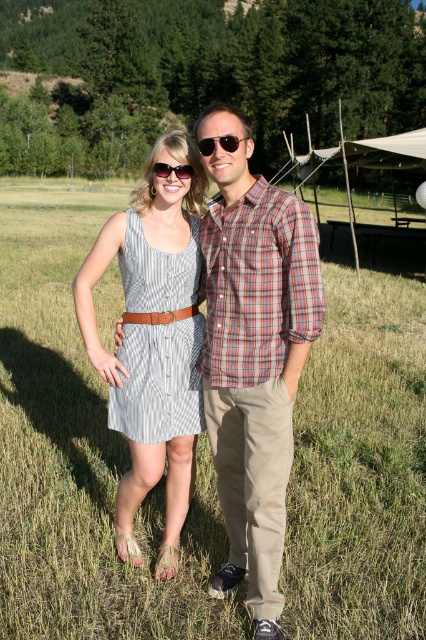
Who is lower down, striped fabric dress at center or striped cotton dress at center?

striped fabric dress at center

Does point (195, 179) come closer to viewer compared to point (186, 396)?

That is True.

This screenshot has width=426, height=640. Find the location of `striped fabric dress at center`. striped fabric dress at center is located at coordinates (152, 340).

Does green grass at center appear on the left side of plaid cotton shirt at center?

Indeed, green grass at center is positioned on the left side of plaid cotton shirt at center.

Who is taller, green grass at center or plaid cotton shirt at center?

Standing taller between the two is green grass at center.

Describe the element at coordinates (81, 452) in the screenshot. I see `green grass at center` at that location.

Identify the location of green grass at center. The image size is (426, 640). (81, 452).

Which is in front, point (210, 145) or point (187, 164)?

Point (210, 145)

Between point (221, 140) and point (158, 164), which one is positioned in front?

Point (221, 140) is in front.

You are a GUI agent. You are given a task and a screenshot of the screen. Output one action in this format:
    pyautogui.click(x=<x>, y=<y>)
    Task: Click on the sunglasses at center
    
    Given the screenshot: What is the action you would take?
    pyautogui.click(x=218, y=144)